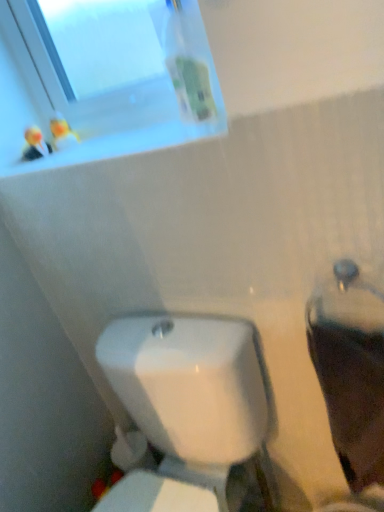
Question: Is white glossy toilet at lower center wider than transparent glass window at upper left?

Choices:
 (A) yes
 (B) no

Answer: (A)

Question: Is white glossy toilet at lower center looking in the opposite direction of transparent glass window at upper left?

Choices:
 (A) no
 (B) yes

Answer: (A)

Question: Considering the relative positions of white glossy toilet at lower center and transparent glass window at upper left in the image provided, is white glossy toilet at lower center to the right of transparent glass window at upper left from the viewer's perspective?

Choices:
 (A) yes
 (B) no

Answer: (A)

Question: Is white glossy toilet at lower center not within transparent glass window at upper left?

Choices:
 (A) no
 (B) yes

Answer: (B)

Question: Can you confirm if white glossy toilet at lower center is shorter than transparent glass window at upper left?

Choices:
 (A) no
 (B) yes

Answer: (A)

Question: Based on their positions, is transparent glass window at upper left located to the left or right of matte white toilet at right?

Choices:
 (A) left
 (B) right

Answer: (A)

Question: In terms of height, does transparent glass window at upper left look taller or shorter compared to matte white toilet at right?

Choices:
 (A) tall
 (B) short

Answer: (B)

Question: From a real-world perspective, relative to matte white toilet at right, is transparent glass window at upper left vertically above or below?

Choices:
 (A) below
 (B) above

Answer: (B)

Question: Is transparent glass window at upper left inside the boundaries of matte white toilet at right, or outside?

Choices:
 (A) inside
 (B) outside

Answer: (B)

Question: Do you think transparent glass window at upper left is within white glossy toilet at lower center, or outside of it?

Choices:
 (A) inside
 (B) outside

Answer: (B)

Question: Is point (155, 121) closer or farther from the camera than point (150, 316)?

Choices:
 (A) farther
 (B) closer

Answer: (B)

Question: Considering the relative positions of transparent glass window at upper left and white glossy toilet at lower center in the image provided, is transparent glass window at upper left to the left or to the right of white glossy toilet at lower center?

Choices:
 (A) right
 (B) left

Answer: (B)

Question: Considering their positions, is transparent glass window at upper left located in front of or behind white glossy toilet at lower center?

Choices:
 (A) behind
 (B) front

Answer: (A)

Question: Considering their positions, is matte white toilet at right located in front of or behind white glossy toilet at lower center?

Choices:
 (A) front
 (B) behind

Answer: (B)

Question: Is matte white toilet at right bigger or smaller than white glossy toilet at lower center?

Choices:
 (A) big
 (B) small

Answer: (B)